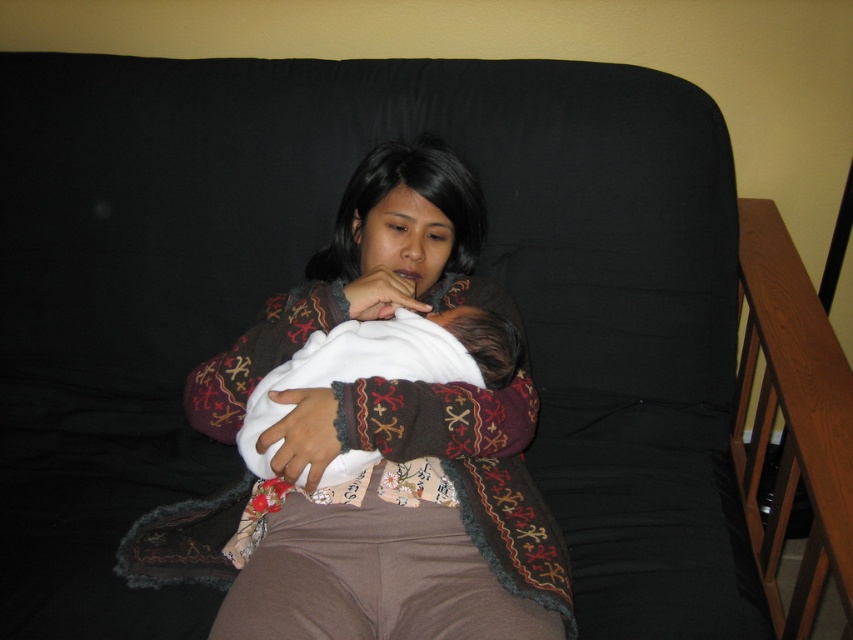
Which of these two, brown textured sweater at center or white soft baby at center, stands taller?

brown textured sweater at center

Is point (439, 612) positioned after point (442, 321)?

No, it is not.

Where is `brown textured sweater at center`? brown textured sweater at center is located at coordinates (402, 522).

The height and width of the screenshot is (640, 853). Find the location of `brown textured sweater at center`. brown textured sweater at center is located at coordinates (402, 522).